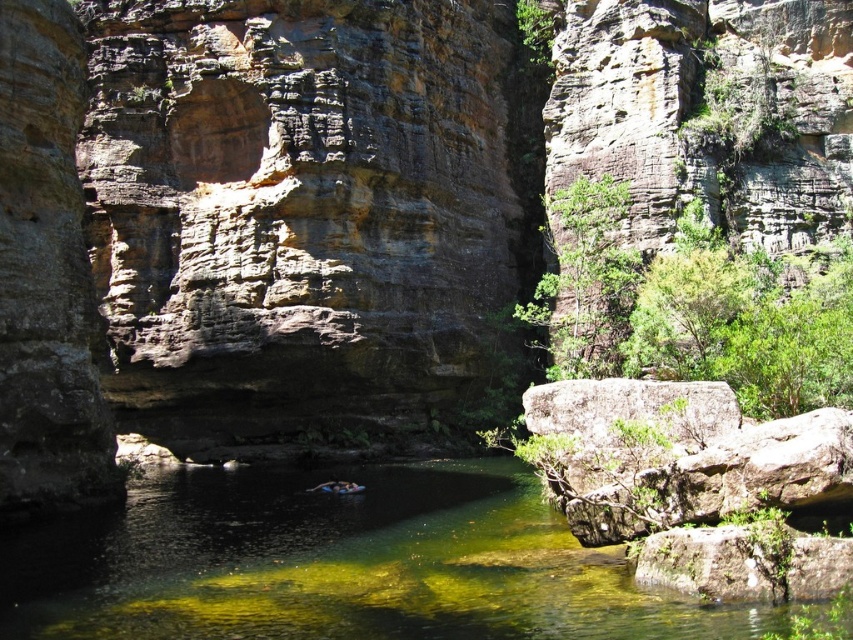
Question: Does clear water at center appear under blue rubber ring at center?

Choices:
 (A) yes
 (B) no

Answer: (A)

Question: Which of the following is the closest to the observer?

Choices:
 (A) (334, 481)
 (B) (146, 618)

Answer: (B)

Question: Can you confirm if clear water at center is positioned below blue rubber ring at center?

Choices:
 (A) yes
 (B) no

Answer: (A)

Question: Does clear water at center appear on the left side of blue rubber ring at center?

Choices:
 (A) no
 (B) yes

Answer: (A)